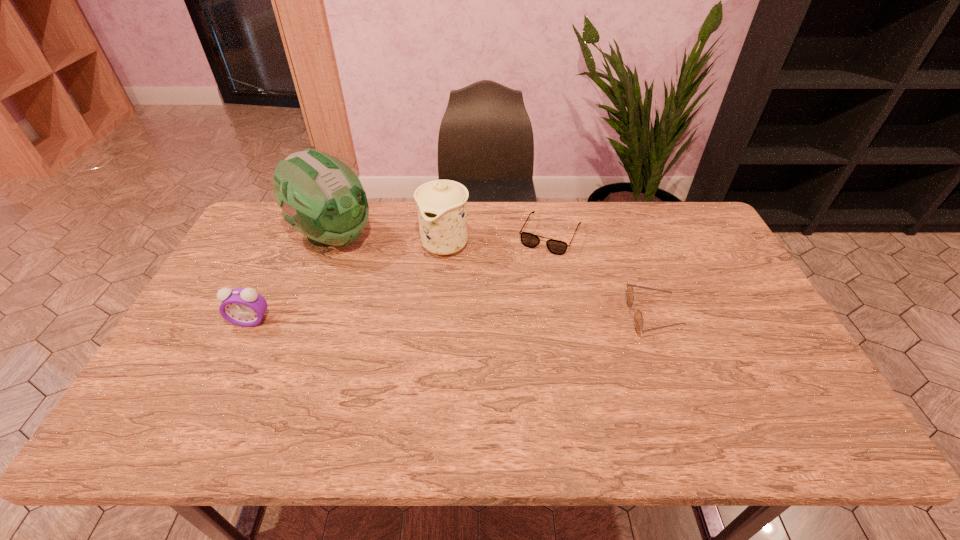
Locate an element on the screen. vacant space on the desktop that is between the alarm clock and the right spectacles and is positioned on the spout of the chinaware is located at coordinates (399, 319).

Image resolution: width=960 pixels, height=540 pixels. What are the coordinates of `free space on the desktop that is between the third shortest object and the nearer spectacles and is positioned on the visor of the football helmet` in the screenshot? It's located at (460, 319).

Locate an element on the screen. vacant space on the desktop that is between the third tallest object and the rightmost object and is positioned on the front-facing side of the left spectacles is located at coordinates (510, 318).